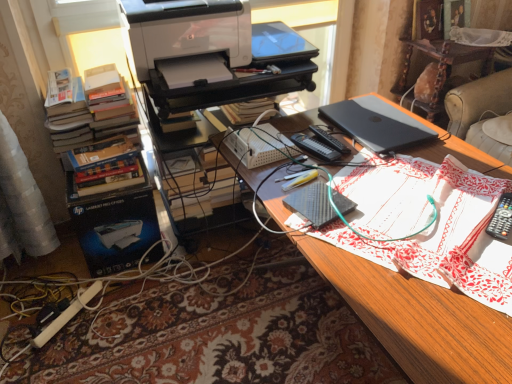
Find the location of `vacant space in front of black textured notebook at center`. vacant space in front of black textured notebook at center is located at coordinates (358, 258).